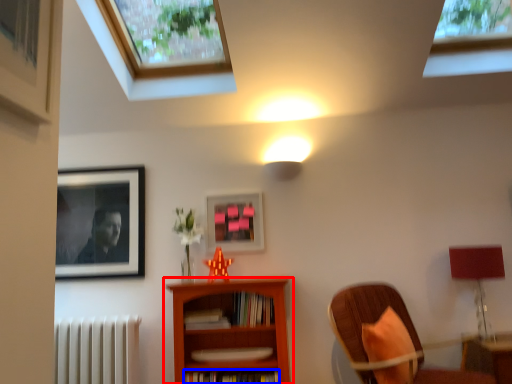
Question: Which point is further to the camera, bookcase (highlighted by a red box) or book (highlighted by a blue box)?

Choices:
 (A) bookcase
 (B) book

Answer: (B)